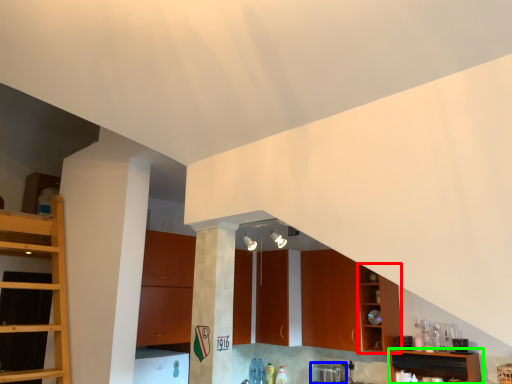
Question: Which is farther away from cabinetry (highlighted by a red box)? appliance (highlighted by a blue box) or shelf (highlighted by a green box)?

Choices:
 (A) appliance
 (B) shelf

Answer: (A)